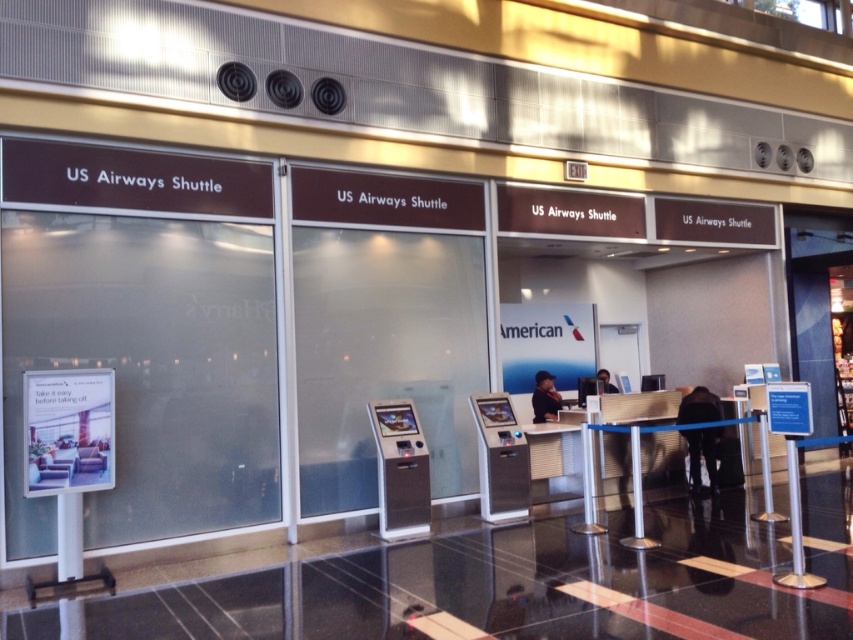
You are a passenger at the US Airways Shuttle counter area. You notice a dark blue shirt at center and a matte black laptop at center. Which object is positioned lower from the ground?

The dark blue shirt at center is below the matte black laptop at center, so the dark blue shirt at center is positioned lower from the ground.

You are a traveler who just arrived at the US Airways Shuttle counter area. You need to place your dark fabric jacket at center and matte black laptop at center onto a luggage cart that can only hold items placed side by side. Based on their positions, can both items fit on the cart if the cart is as wide as the space between them?

The dark fabric jacket at center is positioned on the right side of matte black laptop at center, so the space between them is the width of the jacket plus the laptop. Since the cart is as wide as this space, both items can fit side by side on the cart.